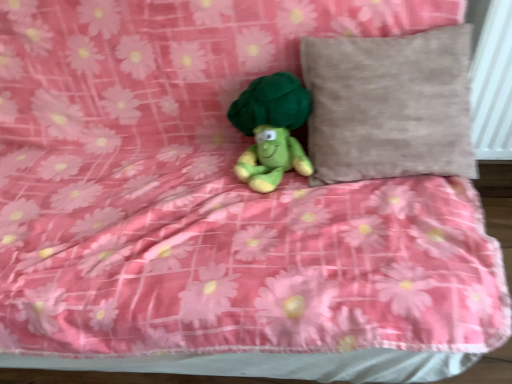
Question: Is beige textured pillow at upper right far away from green plush toy at center?

Choices:
 (A) no
 (B) yes

Answer: (A)

Question: Is beige textured pillow at upper right oriented towards green plush toy at center?

Choices:
 (A) yes
 (B) no

Answer: (B)

Question: From a real-world perspective, is beige textured pillow at upper right over green plush toy at center?

Choices:
 (A) yes
 (B) no

Answer: (A)

Question: Is green plush toy at center surrounded by beige textured pillow at upper right?

Choices:
 (A) no
 (B) yes

Answer: (A)

Question: Considering the relative sizes of beige textured pillow at upper right and green plush toy at center in the image provided, is beige textured pillow at upper right bigger than green plush toy at center?

Choices:
 (A) no
 (B) yes

Answer: (B)

Question: Considering the relative sizes of beige textured pillow at upper right and green plush toy at center in the image provided, is beige textured pillow at upper right thinner than green plush toy at center?

Choices:
 (A) yes
 (B) no

Answer: (B)

Question: Is green plush toy at center outside beige textured pillow at upper right?

Choices:
 (A) yes
 (B) no

Answer: (A)

Question: Is green plush toy at center thinner than beige textured pillow at upper right?

Choices:
 (A) no
 (B) yes

Answer: (B)

Question: Could beige textured pillow at upper right be considered to be inside green plush toy at center?

Choices:
 (A) yes
 (B) no

Answer: (B)

Question: Is green plush toy at center smaller than beige textured pillow at upper right?

Choices:
 (A) yes
 (B) no

Answer: (A)

Question: Considering the relative positions of green plush toy at center and beige textured pillow at upper right in the image provided, is green plush toy at center to the left of beige textured pillow at upper right from the viewer's perspective?

Choices:
 (A) no
 (B) yes

Answer: (B)

Question: Is green plush toy at center positioned with its back to beige textured pillow at upper right?

Choices:
 (A) no
 (B) yes

Answer: (A)

Question: Based on their positions, is green plush toy at center located to the left or right of beige textured pillow at upper right?

Choices:
 (A) right
 (B) left

Answer: (B)